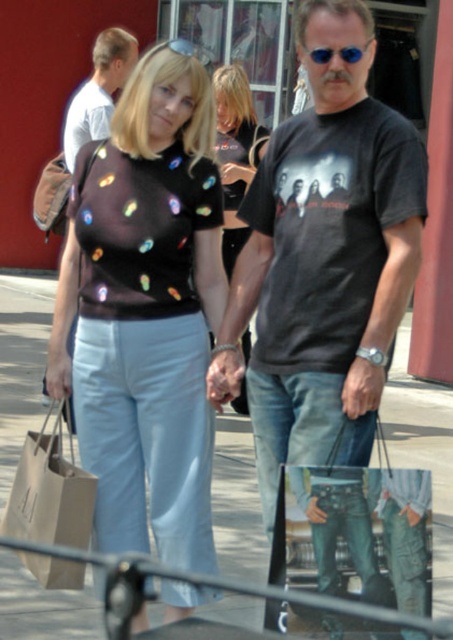
Based on the photo, what is the exact location of the denim at center in the image?

The denim at center is located at point coordinates of (300, 428).